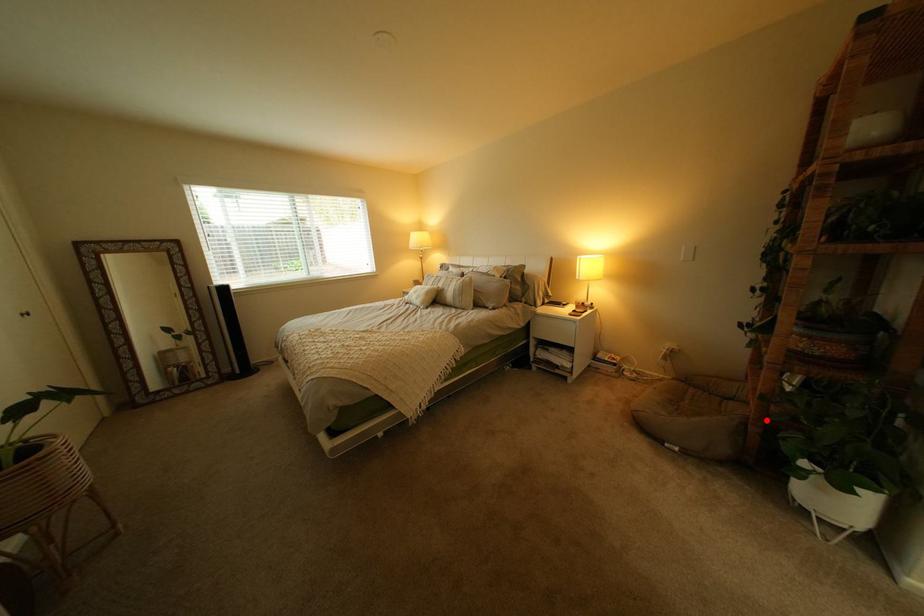
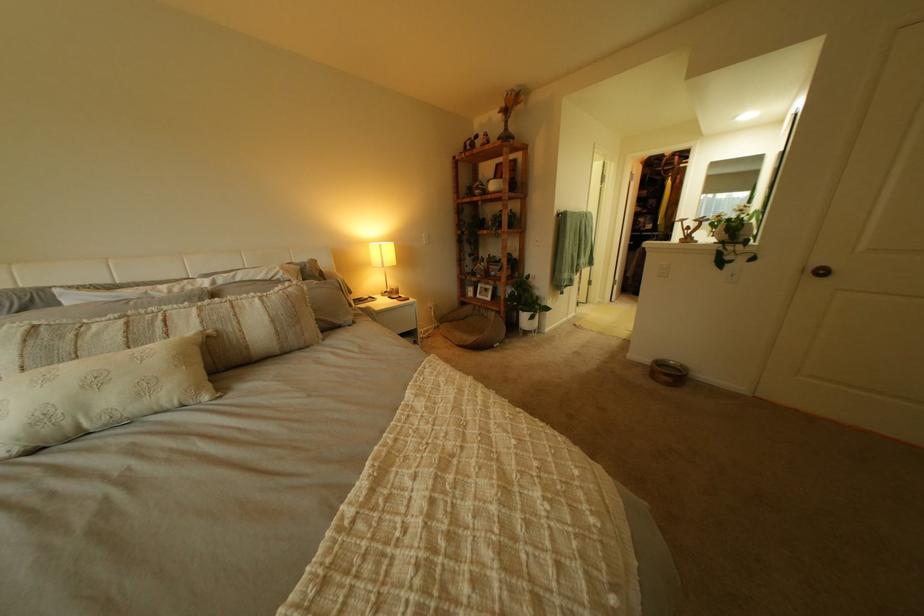
Question: I am providing you with two images of the same scene from different viewpoints. Given a red point in image1, look at the same physical point in image2. Is it:

Choices:
 (A) Closer to the viewpoint
 (B) Farther from the viewpoint

Answer: (A)